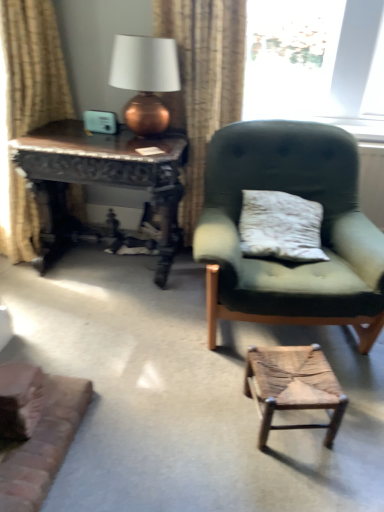
Question: Is rustic wood stool at lower center located outside wooden carved table at left?

Choices:
 (A) yes
 (B) no

Answer: (A)

Question: Can you confirm if rustic wood stool at lower center is smaller than wooden carved table at left?

Choices:
 (A) no
 (B) yes

Answer: (B)

Question: Is rustic wood stool at lower center positioned behind wooden carved table at left?

Choices:
 (A) yes
 (B) no

Answer: (B)

Question: Considering the relative sizes of rustic wood stool at lower center and wooden carved table at left in the image provided, is rustic wood stool at lower center shorter than wooden carved table at left?

Choices:
 (A) no
 (B) yes

Answer: (B)

Question: Does rustic wood stool at lower center have a greater height compared to wooden carved table at left?

Choices:
 (A) no
 (B) yes

Answer: (A)

Question: In terms of width, does beige fabric curtain at left, the first curtain when ordered from left to right, look wider or thinner when compared to beige textured curtain at upper center, acting as the first curtain starting from the right?

Choices:
 (A) wide
 (B) thin

Answer: (A)

Question: Considering the positions of beige fabric curtain at left, positioned as the 2th curtain in right-to-left order, and beige textured curtain at upper center, which is the 2th curtain from left to right, in the image, is beige fabric curtain at left, positioned as the 2th curtain in right-to-left order, taller or shorter than beige textured curtain at upper center, which is the 2th curtain from left to right,?

Choices:
 (A) tall
 (B) short

Answer: (A)

Question: Considering their positions, is beige fabric curtain at left, positioned as the 2th curtain in right-to-left order, located in front of or behind beige textured curtain at upper center, which is the 2th curtain from left to right?

Choices:
 (A) behind
 (B) front

Answer: (B)

Question: In terms of size, does beige fabric curtain at left, the first curtain when ordered from left to right, appear bigger or smaller than beige textured curtain at upper center, which is the 2th curtain from left to right?

Choices:
 (A) big
 (B) small

Answer: (A)

Question: Is point (307, 347) positioned closer to the camera than point (23, 218)?

Choices:
 (A) farther
 (B) closer

Answer: (B)

Question: Relative to beige fabric curtain at left, positioned as the 2th curtain in right-to-left order, is rustic wood stool at lower center in front or behind?

Choices:
 (A) behind
 (B) front

Answer: (B)

Question: From the image's perspective, relative to beige fabric curtain at left, the first curtain when ordered from left to right, is rustic wood stool at lower center above or below?

Choices:
 (A) above
 (B) below

Answer: (B)

Question: Which is correct: rustic wood stool at lower center is inside beige fabric curtain at left, positioned as the 2th curtain in right-to-left order, or outside of it?

Choices:
 (A) outside
 (B) inside

Answer: (A)

Question: Considering their positions, is beige textured curtain at upper center, acting as the first curtain starting from the right, located in front of or behind green fabric chair at center?

Choices:
 (A) behind
 (B) front

Answer: (A)

Question: Is beige textured curtain at upper center, acting as the first curtain starting from the right, wider or thinner than green fabric chair at center?

Choices:
 (A) wide
 (B) thin

Answer: (B)